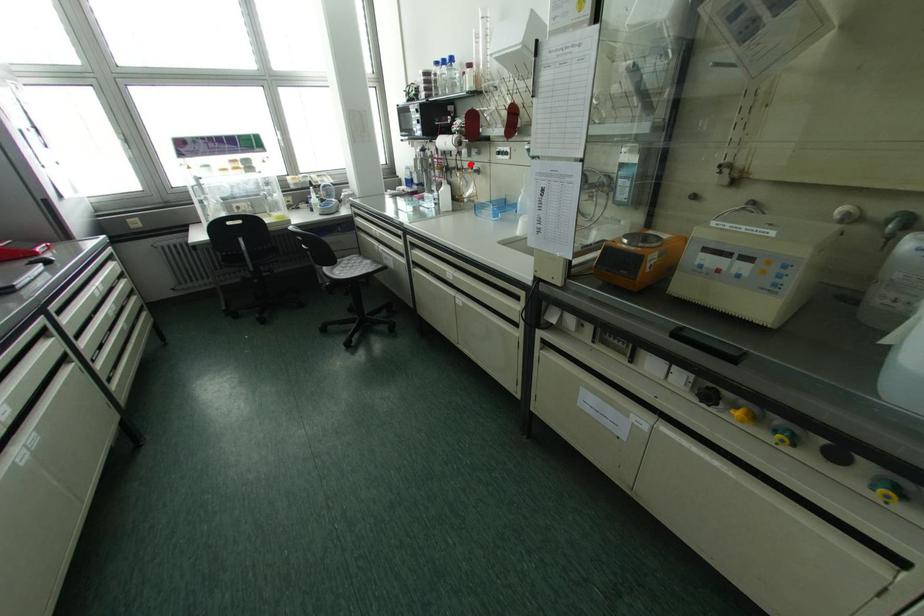
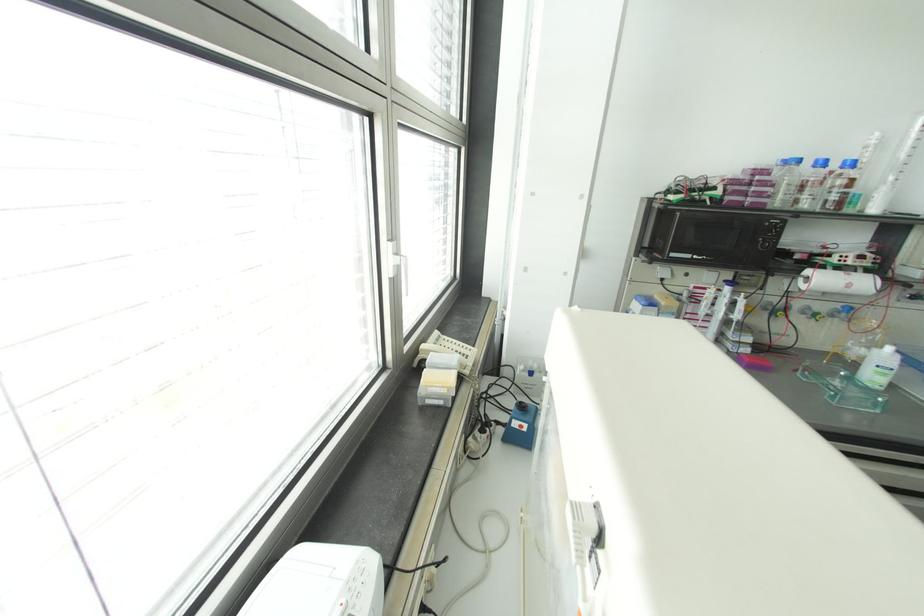
In the second image, find the point that corresponds to the highlighted location in the first image.

(848, 309)